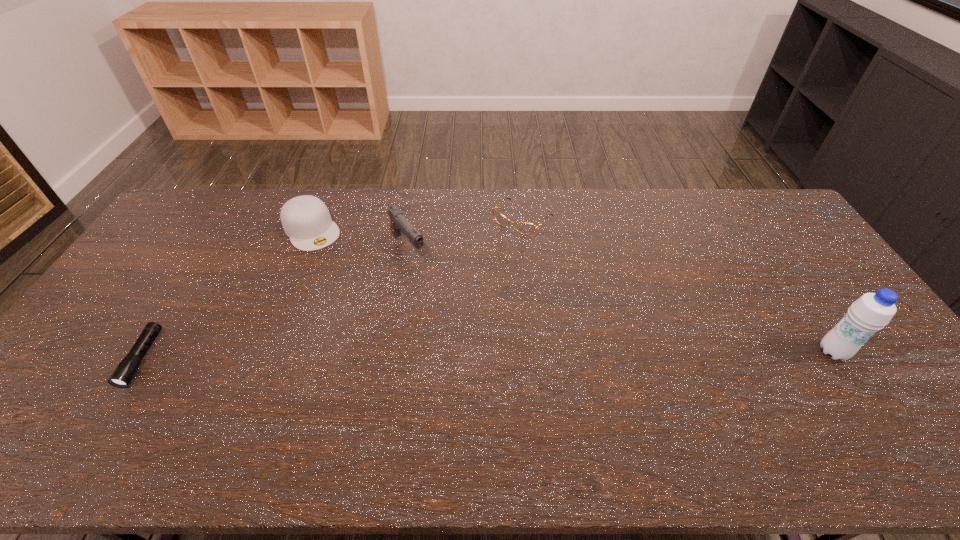
Select which object is the closest to the tallest object. Please provide its 2D coordinates. Your answer should be formatted as a tuple, i.e. [(x, y)], where the tuple contains the x and y coordinates of a point satisfying the conditions above.

[(522, 227)]

Where is `vacant space that satisfies the following two spatial constraints: 1. on the front side of the tallest object; 2. on the left side of the third shortest object`? vacant space that satisfies the following two spatial constraints: 1. on the front side of the tallest object; 2. on the left side of the third shortest object is located at coordinates (261, 352).